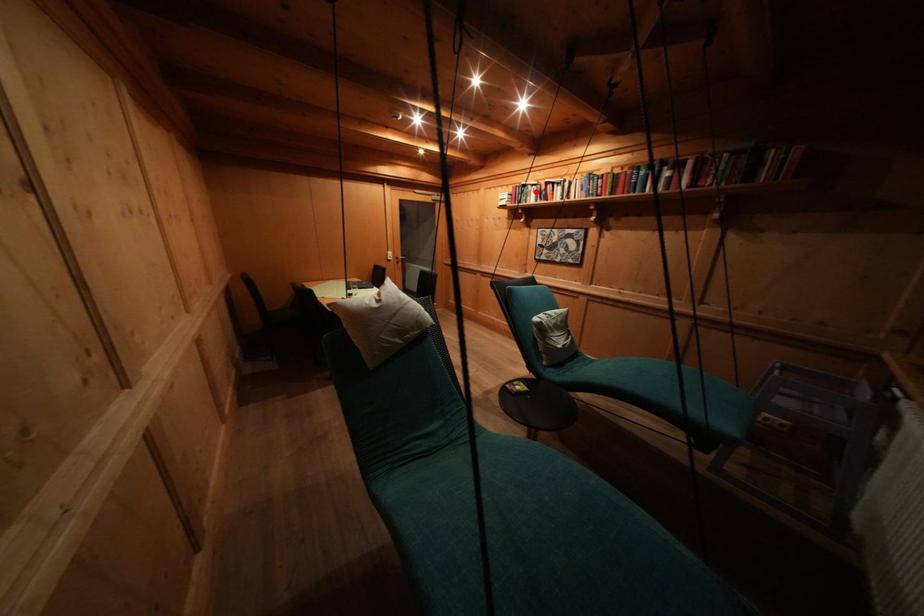
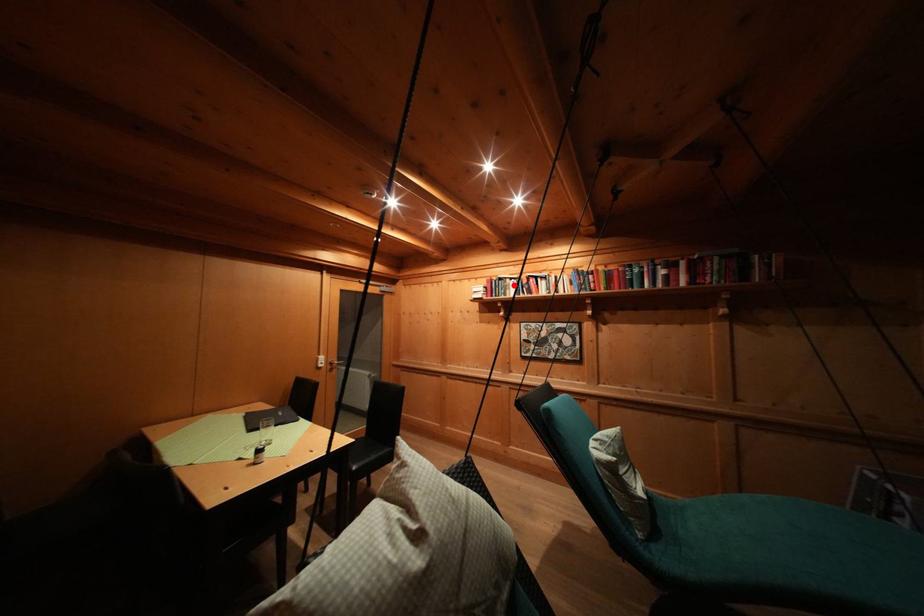
I am providing you with two images of the same scene from different viewpoints. A red point is marked on the first image and another point is marked on the second image. Does the point marked in image1 correspond to the same location as the one in image2?

Yes